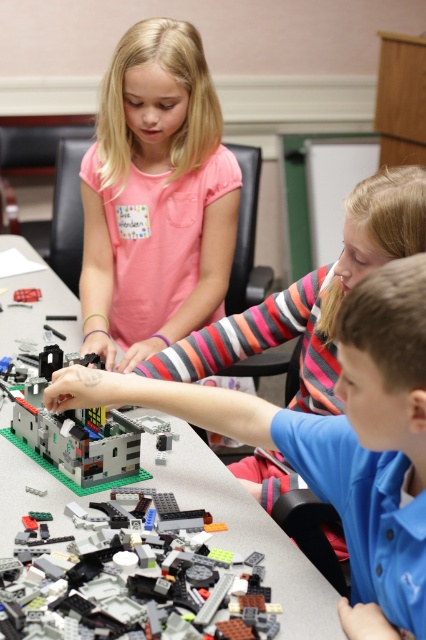
Question: Among these points, which one is nearest to the camera?

Choices:
 (A) (3, 451)
 (B) (189, 326)

Answer: (A)

Question: Observing the image, what is the correct spatial positioning of matte pink shirt at upper center in reference to translucent plastic lego at center?

Choices:
 (A) right
 (B) left

Answer: (A)

Question: Can you confirm if matte pink shirt at upper center is bigger than translucent gray plastic building at center?

Choices:
 (A) no
 (B) yes

Answer: (B)

Question: Which object appears closest to the camera in this image?

Choices:
 (A) translucent gray plastic building at center
 (B) matte pink shirt at upper center

Answer: (A)

Question: Can you confirm if matte pink shirt at upper center is positioned below translucent gray plastic building at center?

Choices:
 (A) yes
 (B) no

Answer: (B)

Question: Which point is farther to the camera?

Choices:
 (A) click(28, 296)
 (B) click(152, 484)

Answer: (A)